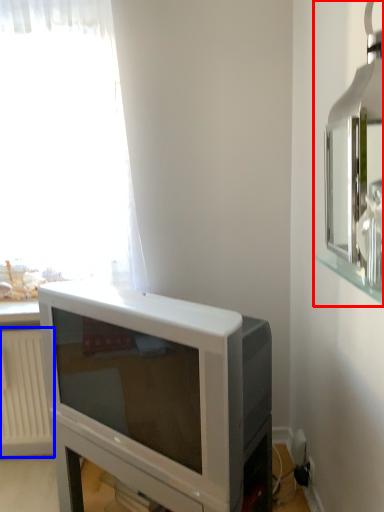
Question: Which object appears closest to the camera in this image, medicine cabinet (highlighted by a red box) or radiator (highlighted by a blue box)?

Choices:
 (A) medicine cabinet
 (B) radiator

Answer: (A)